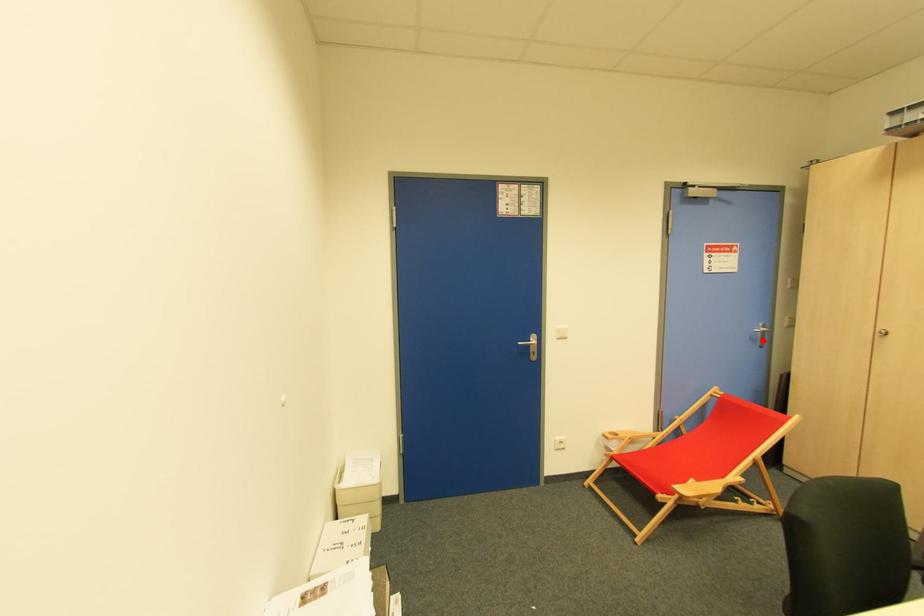
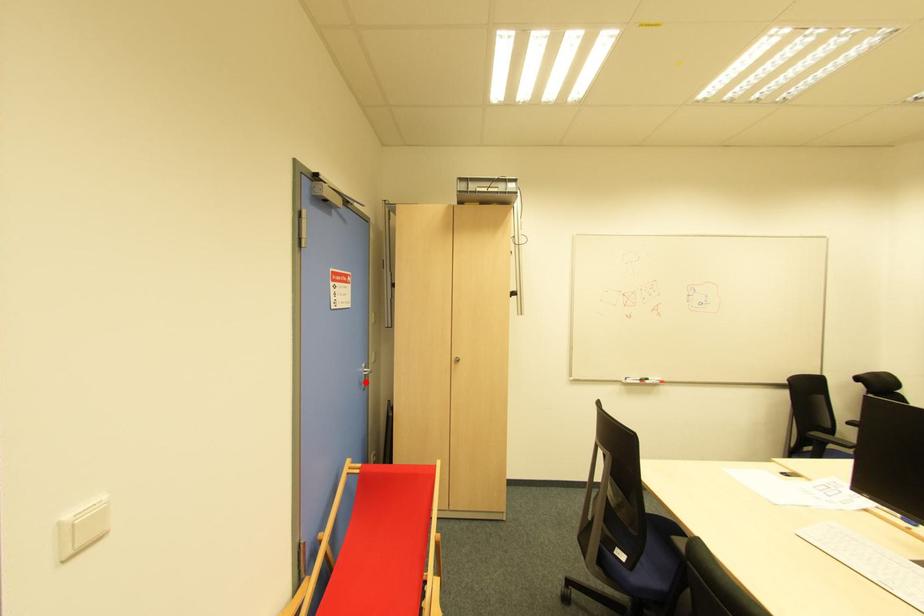
I am providing you with two images of the same scene from different viewpoints. A red point is marked on the first image and another point is marked on the second image. Are the points marked in image1 and image2 representing the same 3D position?

Yes